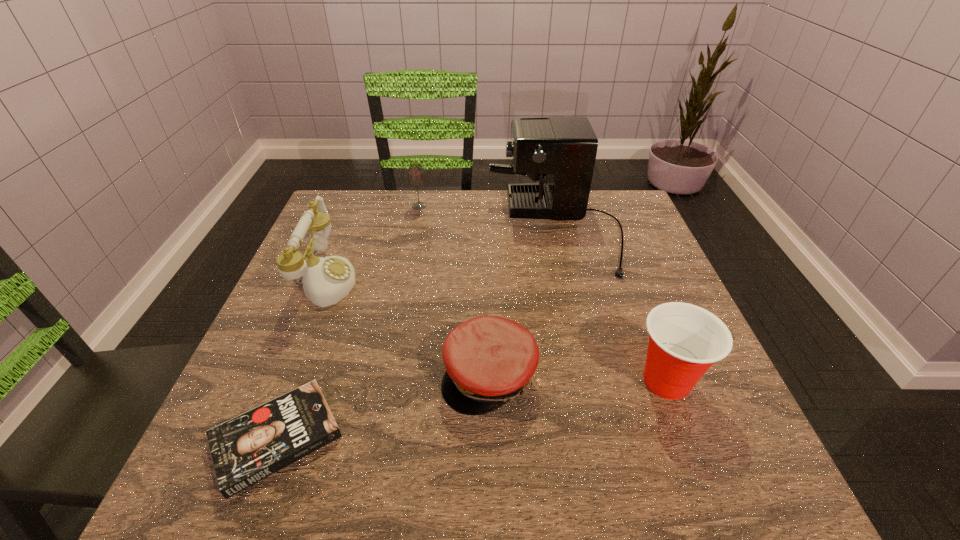
What are the coordinates of `vacant space that satisfies the following two spatial constraints: 1. on the dial of the fifth shortest object; 2. on the back side of the cup` in the screenshot? It's located at (285, 381).

This screenshot has width=960, height=540. I want to click on vacant region that satisfies the following two spatial constraints: 1. on the dial of the second tallest object; 2. on the right side of the cup, so click(285, 381).

At what (x,y) coordinates should I click in order to perform the action: click on vacant space that satisfies the following two spatial constraints: 1. on the front-facing side of the tallest object; 2. on the front-facing side of the fifth tallest object. Please return your answer as a coordinate pair (x, y). The height and width of the screenshot is (540, 960). Looking at the image, I should click on (588, 376).

Find the location of a particular element. This screenshot has width=960, height=540. free point that satisfies the following two spatial constraints: 1. on the front side of the third object from left to right; 2. on the dial of the telephone is located at coordinates (405, 279).

Find the location of a particular element. This screenshot has height=540, width=960. blank area in the image that satisfies the following two spatial constraints: 1. on the front-facing side of the coffee maker; 2. on the front-facing side of the fifth tallest object is located at coordinates (588, 376).

At what (x,y) coordinates should I click in order to perform the action: click on free location that satisfies the following two spatial constraints: 1. on the dial of the fifth shortest object; 2. on the back side of the book. Please return your answer as a coordinate pair (x, y). Looking at the image, I should click on (263, 438).